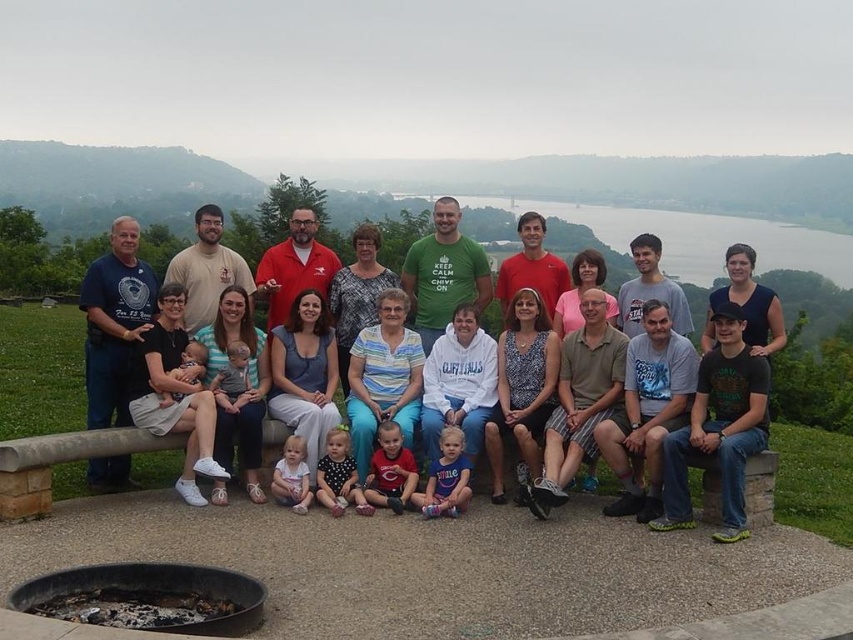
You are a photographer trying to capture a photo that includes both the matte blue jeans at center and the green water at upper center. Given that your camera has a maximum focus range of 25 meters, will you be able to capture both subjects in focus without adjusting your camera settings?

The matte blue jeans at center and green water at upper center are 24.41 meters apart from each other. Since the distance between them is within the camera maximum focus range of 25 meters, you can capture both subjects in focus without adjusting your camera settings.